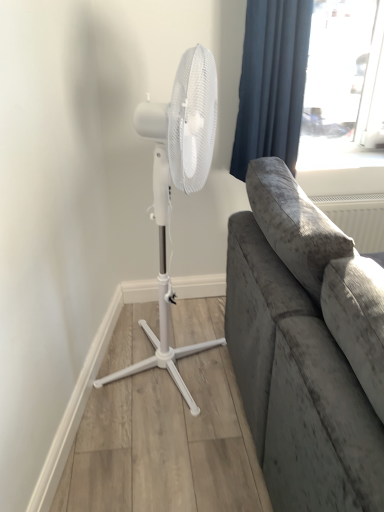
Question: Would you say white plastic mechanical fan at left is to the left or to the right of blue velvet curtain at upper right in the picture?

Choices:
 (A) left
 (B) right

Answer: (A)

Question: Is white plastic mechanical fan at left inside the boundaries of blue velvet curtain at upper right, or outside?

Choices:
 (A) outside
 (B) inside

Answer: (A)

Question: Looking at the image, does white plastic mechanical fan at left seem bigger or smaller compared to blue velvet curtain at upper right?

Choices:
 (A) small
 (B) big

Answer: (B)

Question: Is blue velvet curtain at upper right wider or thinner than white plastic mechanical fan at left?

Choices:
 (A) thin
 (B) wide

Answer: (A)

Question: In terms of size, does blue velvet curtain at upper right appear bigger or smaller than white plastic mechanical fan at left?

Choices:
 (A) big
 (B) small

Answer: (B)

Question: From a real-world perspective, is blue velvet curtain at upper right positioned above or below white plastic mechanical fan at left?

Choices:
 (A) below
 (B) above

Answer: (B)

Question: Considering the positions of blue velvet curtain at upper right and white plastic mechanical fan at left in the image, is blue velvet curtain at upper right taller or shorter than white plastic mechanical fan at left?

Choices:
 (A) tall
 (B) short

Answer: (B)